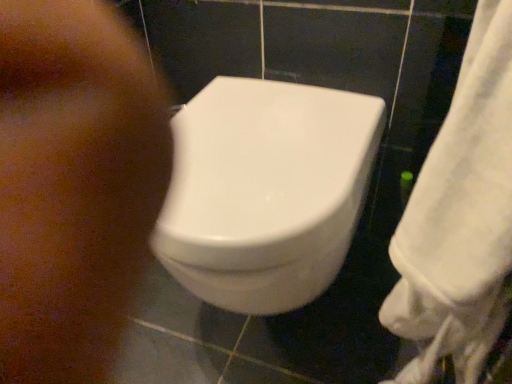
Question: Is white fabric towel at right smaller than white glossy toilet at center?

Choices:
 (A) yes
 (B) no

Answer: (A)

Question: Considering the relative sizes of white fabric towel at right and white glossy toilet at center in the image provided, is white fabric towel at right wider than white glossy toilet at center?

Choices:
 (A) no
 (B) yes

Answer: (A)

Question: Is white fabric towel at right shorter than white glossy toilet at center?

Choices:
 (A) yes
 (B) no

Answer: (B)

Question: From the image's perspective, is white fabric towel at right above white glossy toilet at center?

Choices:
 (A) yes
 (B) no

Answer: (A)

Question: From a real-world perspective, is white fabric towel at right positioned over white glossy toilet at center based on gravity?

Choices:
 (A) no
 (B) yes

Answer: (B)

Question: Does white fabric towel at right have a lesser width compared to white glossy toilet at center?

Choices:
 (A) no
 (B) yes

Answer: (B)

Question: Is white glossy toilet at center next to brown matte skin at lower left and touching it?

Choices:
 (A) no
 (B) yes

Answer: (A)

Question: Considering the relative sizes of white glossy toilet at center and brown matte skin at lower left in the image provided, is white glossy toilet at center bigger than brown matte skin at lower left?

Choices:
 (A) no
 (B) yes

Answer: (B)

Question: Is white glossy toilet at center positioned far away from brown matte skin at lower left?

Choices:
 (A) yes
 (B) no

Answer: (B)

Question: From the image's perspective, is white glossy toilet at center located beneath brown matte skin at lower left?

Choices:
 (A) no
 (B) yes

Answer: (B)

Question: Does white glossy toilet at center have a smaller size compared to brown matte skin at lower left?

Choices:
 (A) no
 (B) yes

Answer: (A)

Question: Could brown matte skin at lower left be considered to be inside white glossy toilet at center?

Choices:
 (A) yes
 (B) no

Answer: (B)

Question: Is brown matte skin at lower left positioned far away from white fabric towel at right?

Choices:
 (A) no
 (B) yes

Answer: (A)